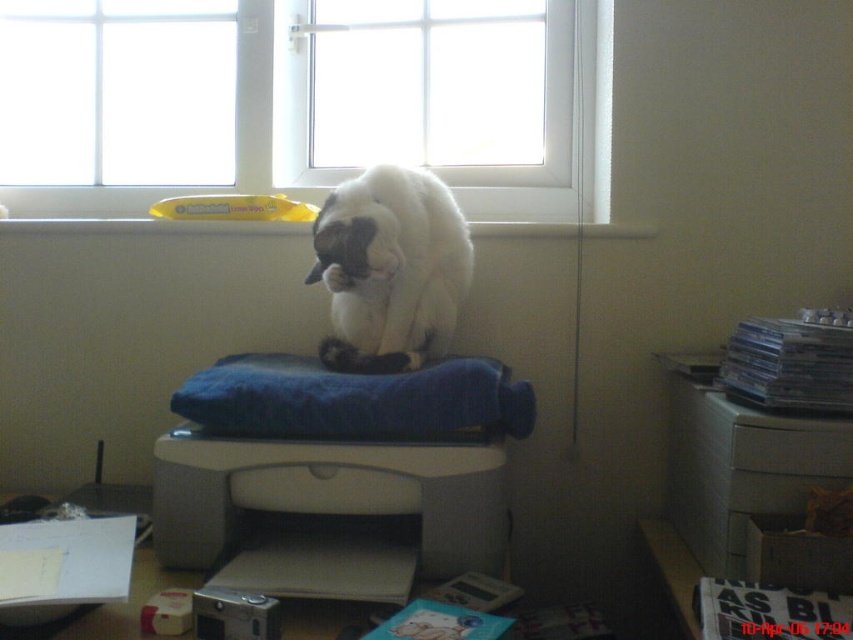
You are a delivery person who just arrived at the house. You see the white plastic window at upper center and the gray matte printer at center. Which object is closer to the right side of the room?

The white plastic window at upper center is closer to the right side of the room because it is positioned to the right of the gray matte printer at center.

Consider the image. You are an interior designer planning to install a new light fixture. You need to know which object, the white plastic window at upper center or the gray matte printer at center, occupies more space in the room. Which one is larger?

The white plastic window at upper center is larger than the gray matte printer at center, so it occupies more space in the room.